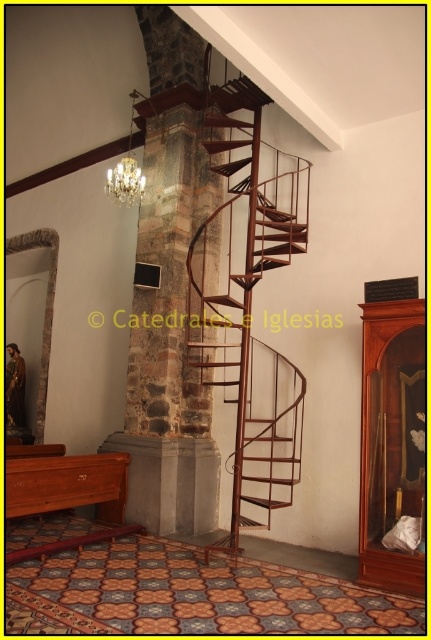
You are a maintenance worker needing to reach the gold metallic chandelier at upper center from the rustic metal spiral staircase at center. The ladder you have is 5 feet long. Is the ladder sufficient to reach the chandelier?

The distance between the rustic metal spiral staircase at center and the gold metallic chandelier at upper center is 6.04 feet. Since the ladder is only 5 feet long, it is not long enough to reach the chandelier.

You are standing at the base of the stone pillar in the church. You see a point marked at coordinates (247, 298). What object is located at that point?

The point at coordinates (247, 298) corresponds to the rustic metal spiral staircase at center.